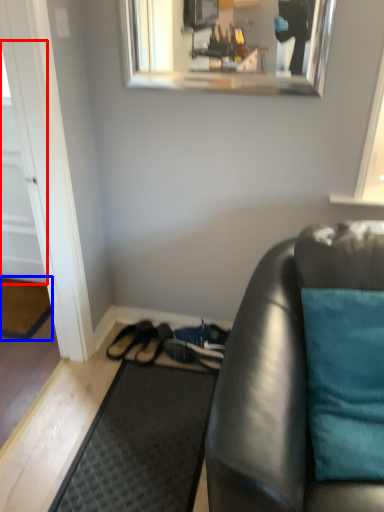
Question: Among these objects, which one is nearest to the camera, door (highlighted by a red box) or doormat (highlighted by a blue box)?

Choices:
 (A) door
 (B) doormat

Answer: (A)